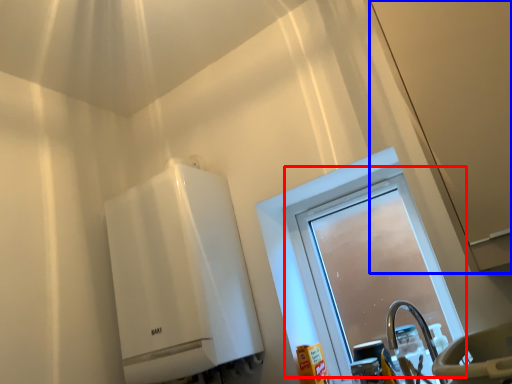
Question: Among these objects, which one is nearest to the camera, window (highlighted by a red box) or screen door (highlighted by a blue box)?

Choices:
 (A) window
 (B) screen door

Answer: (B)